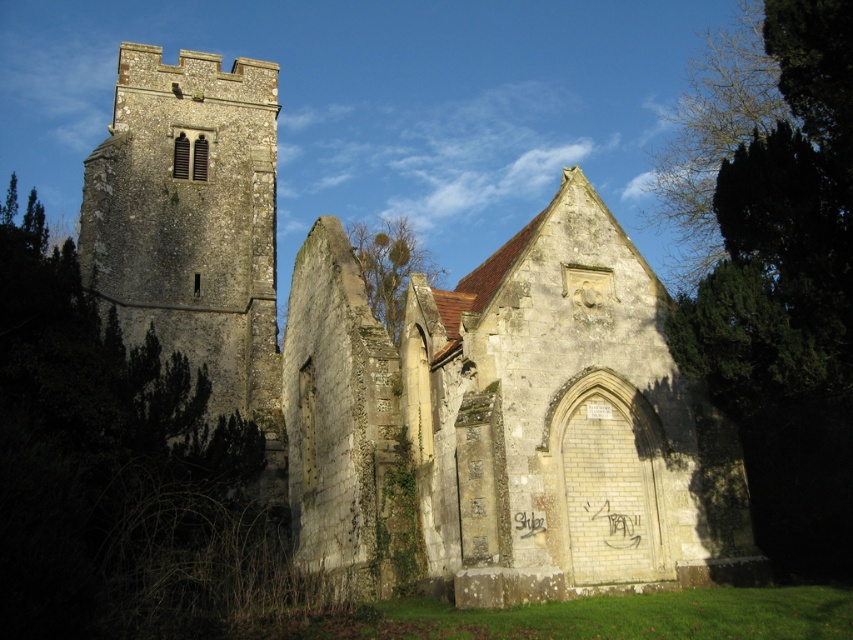
Question: Does stone church at center have a smaller size compared to green leafy tree at center?

Choices:
 (A) yes
 (B) no

Answer: (B)

Question: Observing the image, what is the correct spatial positioning of stone tower at left in reference to green leafy tree at center?

Choices:
 (A) below
 (B) above

Answer: (B)

Question: Which point is farther to the camera?

Choices:
 (A) stone tower at left
 (B) green leafy tree at center
 (C) green leafy tree at right
 (D) stone church at center

Answer: (A)

Question: Based on their relative distances, which object is farther from the green leafy tree at left?

Choices:
 (A) green leafy tree at center
 (B) stone tower at left
 (C) stone church at center

Answer: (A)

Question: Is green leafy tree at left smaller than green leafy tree at right?

Choices:
 (A) yes
 (B) no

Answer: (B)

Question: Among these points, which one is farthest from the camera?

Choices:
 (A) (405, 273)
 (B) (804, 396)

Answer: (A)